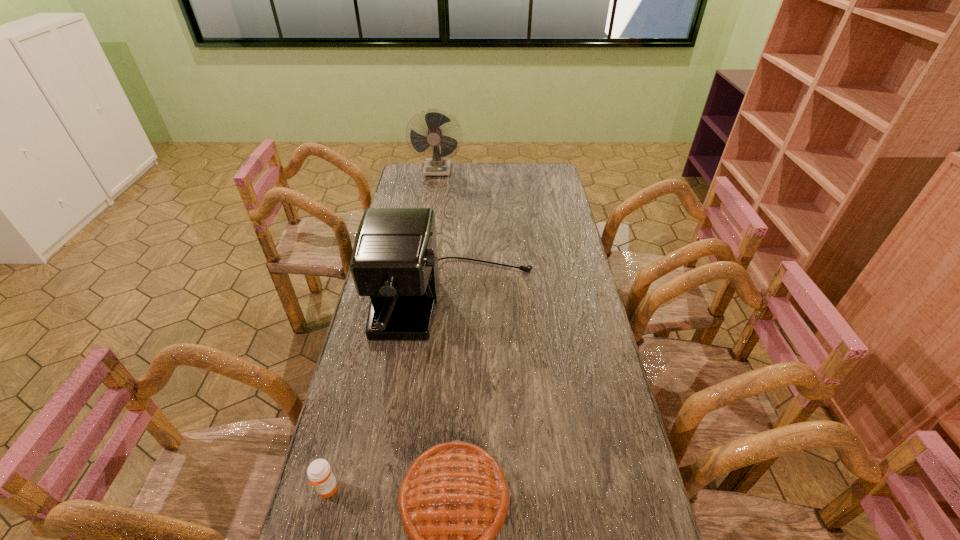
This screenshot has width=960, height=540. Identify the location of fan. (437, 165).

The width and height of the screenshot is (960, 540). I want to click on the second farthest object, so click(394, 261).

Locate an element on the screen. The height and width of the screenshot is (540, 960). medicine is located at coordinates (319, 472).

I want to click on free spot located on the front-facing side of the farthest object, so click(430, 220).

The image size is (960, 540). I want to click on vacant area situated 0.250m on the front-facing side of the coffee maker, so click(x=445, y=438).

Where is `free spot located 0.260m on the back of the medicine`? The image size is (960, 540). free spot located 0.260m on the back of the medicine is located at coordinates (353, 387).

Where is `object present at the far edge`? object present at the far edge is located at coordinates (437, 165).

Locate an element on the screen. Image resolution: width=960 pixels, height=540 pixels. fan located in the left edge section of the desktop is located at coordinates (437, 165).

The image size is (960, 540). What are the coordinates of `coffee maker that is at the left edge` in the screenshot? It's located at (394, 261).

Identify the location of medicine that is positioned at the left edge. This screenshot has height=540, width=960. (319, 472).